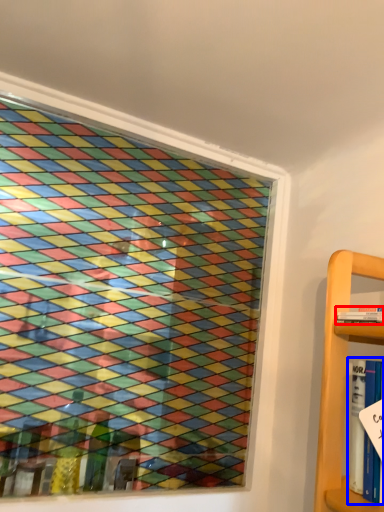
Question: Which object appears closest to the camera in this image, book (highlighted by a red box) or book (highlighted by a blue box)?

Choices:
 (A) book
 (B) book

Answer: (B)